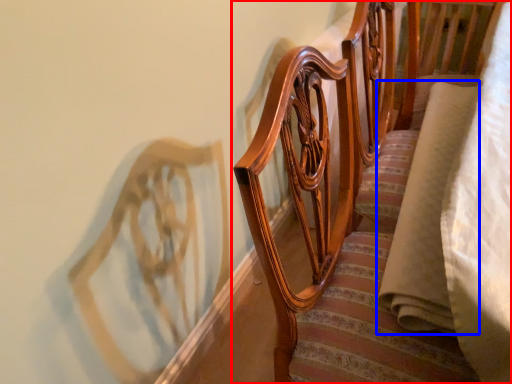
Question: Which point is closer to the camera, furniture (highlighted by a red box) or fabric (highlighted by a blue box)?

Choices:
 (A) furniture
 (B) fabric

Answer: (A)